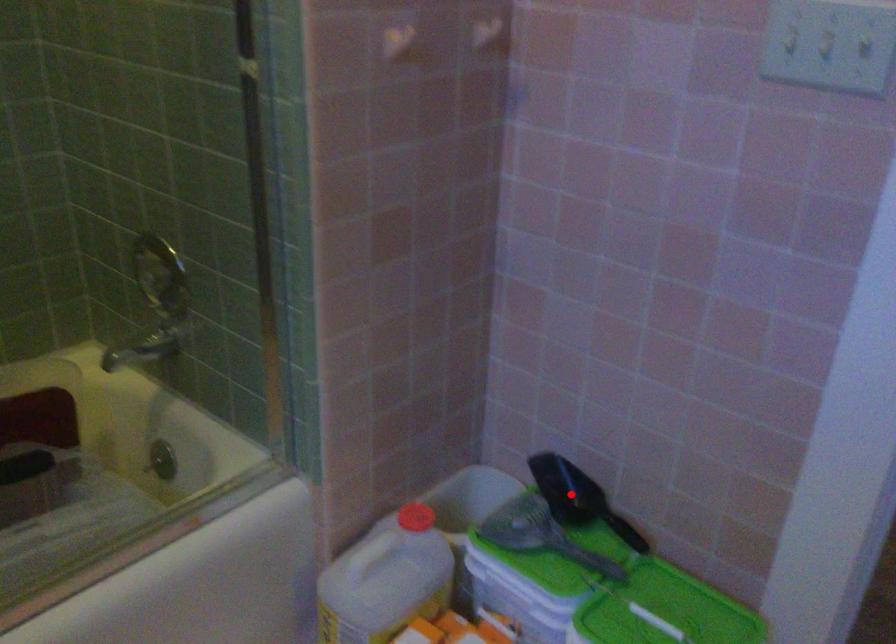
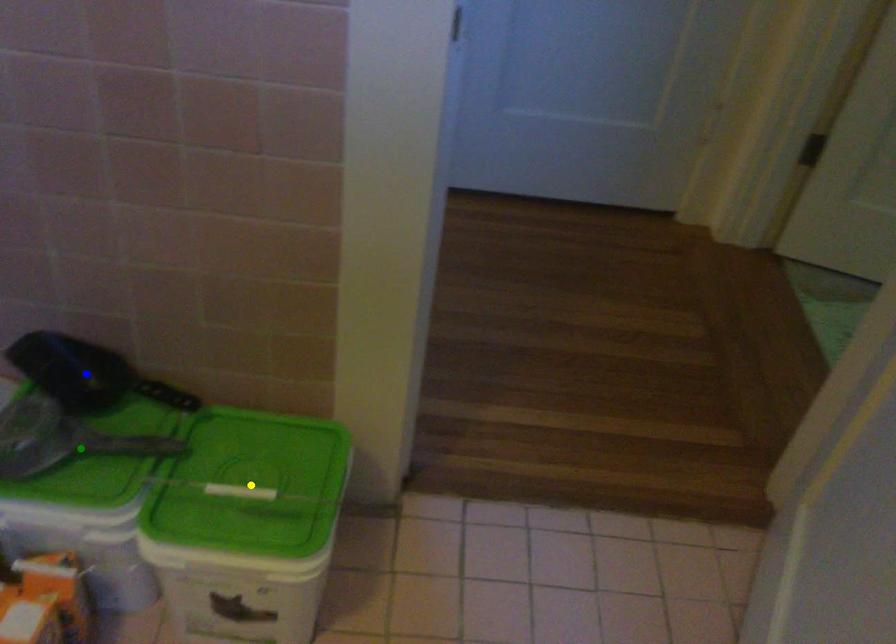
Question: I am providing you with two images of the same scene from different viewpoints. A red point is marked on the first image. You are given multiple points on the second image. Which point in image 2 is actually the same real-world point as the red point in image 1?

Choices:
 (A) green point
 (B) yellow point
 (C) blue point

Answer: (C)